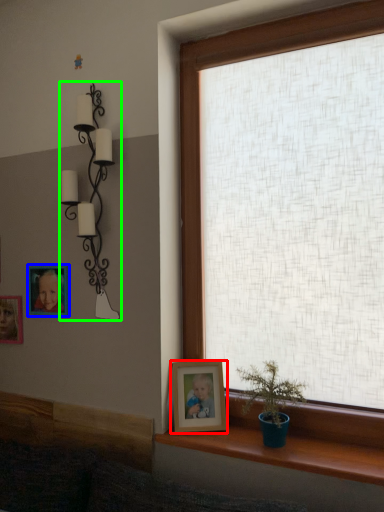
Question: Considering the real-world distances, which object is closest to picture frame (highlighted by a red box)? picture frame (highlighted by a blue box) or lamp (highlighted by a green box).

Choices:
 (A) picture frame
 (B) lamp

Answer: (B)